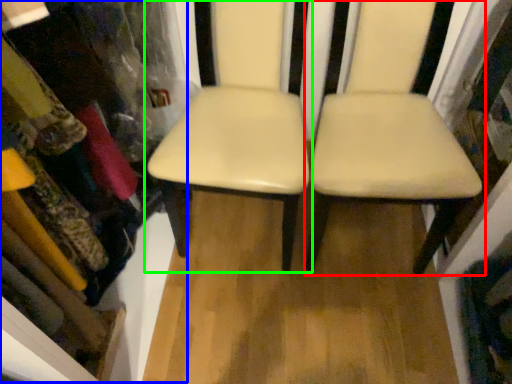
Question: Which is nearer to the chair (highlighted by a red box)? bookshelf (highlighted by a blue box) or chair (highlighted by a green box).

Choices:
 (A) bookshelf
 (B) chair

Answer: (B)